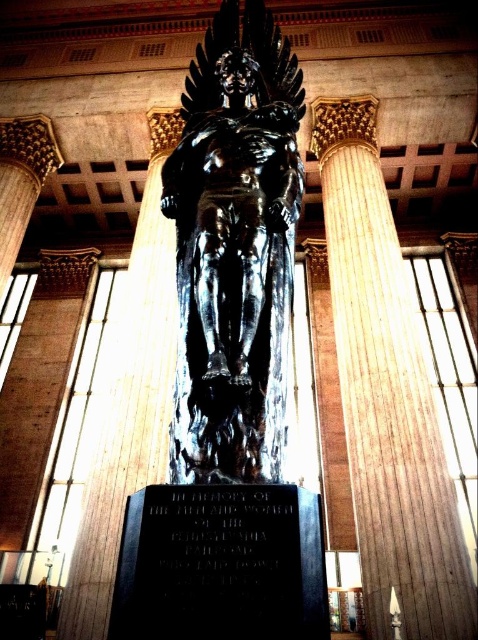
Question: Among these objects, which one is farthest from the camera?

Choices:
 (A) black stone plaque at center
 (B) smooth beige column at center

Answer: (B)

Question: Is black polished statue at center to the left of black stone plaque at center from the viewer's perspective?

Choices:
 (A) no
 (B) yes

Answer: (B)

Question: Can you confirm if black polished statue at center is smaller than smooth beige column at center?

Choices:
 (A) no
 (B) yes

Answer: (B)

Question: Which point is farther to the camera?

Choices:
 (A) black stone plaque at center
 (B) smooth beige column at center

Answer: (B)

Question: Is black polished statue at center wider than smooth beige column at center?

Choices:
 (A) no
 (B) yes

Answer: (A)

Question: Estimate the real-world distances between objects in this image. Which object is closer to the black polished statue at center?

Choices:
 (A) black stone plaque at center
 (B) smooth beige column at center

Answer: (A)